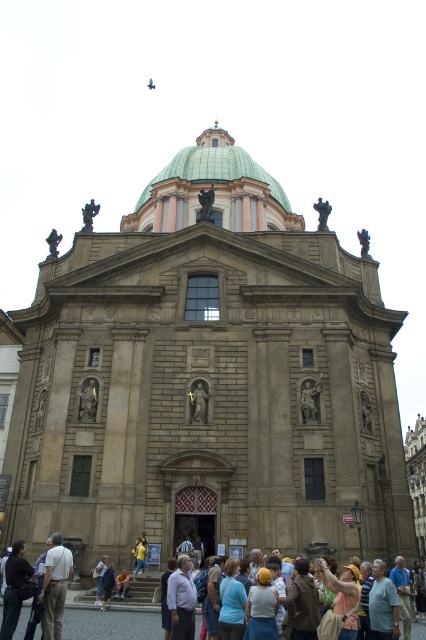
You are standing in front of the grand historic building and see a brown leather jacket at lower center and a blue fabric shirt at lower right. Which clothing item is closer to you?

The brown leather jacket at lower center is closer to you because it is in front of the blue fabric shirt at lower right.

You are standing in front of the historic building and want to take a photo of both the green glazed dome at upper center and the light brown fabric crowd at lower center. Which object should you focus on first to ensure both are in clear view?

You should focus on the green glazed dome at upper center first because it is closer to you than the light brown fabric crowd at lower center, so adjusting focus from near to far will help both be in clear view.